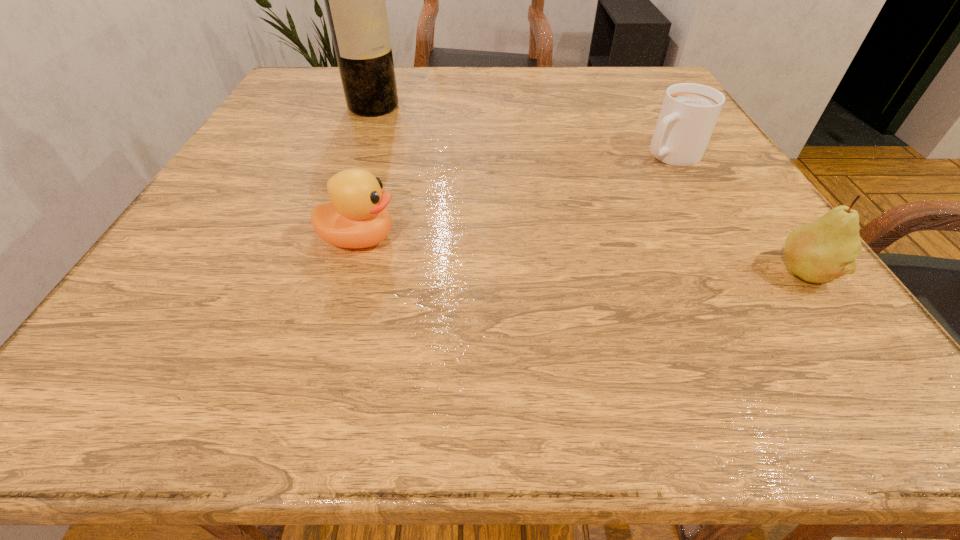
The width and height of the screenshot is (960, 540). In order to click on free point between the cappuccino and the duckling in this screenshot , I will do `click(515, 197)`.

Where is `free space between the cappuccino and the pear`? The image size is (960, 540). free space between the cappuccino and the pear is located at coordinates (737, 214).

This screenshot has width=960, height=540. I want to click on object that is the nearest to the liquor, so click(357, 217).

Identify which object is located as the second nearest to the pear. Please provide its 2D coordinates. Your answer should be formatted as a tuple, i.e. [(x, y)], where the tuple contains the x and y coordinates of a point satisfying the conditions above.

[(357, 217)]

In order to click on free space that satisfies the following two spatial constraints: 1. on the front side of the pear; 2. on the left side of the liquor in this screenshot , I will do `click(312, 273)`.

Locate an element on the screen. This screenshot has height=540, width=960. free point that satisfies the following two spatial constraints: 1. on the front side of the tallest object; 2. on the right side of the pear is located at coordinates (312, 273).

You are a GUI agent. You are given a task and a screenshot of the screen. Output one action in this format:
    pyautogui.click(x=<x>, y=<y>)
    Task: Click on the vacant space that satisfies the following two spatial constraints: 1. on the front side of the second farthest object; 2. on the right side of the pear
    
    Given the screenshot: What is the action you would take?
    pyautogui.click(x=737, y=273)